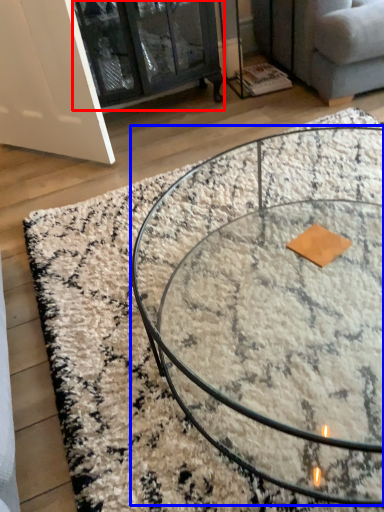
Question: Which of the following is the farthest to the observer, glass door (highlighted by a red box) or coffee table (highlighted by a blue box)?

Choices:
 (A) glass door
 (B) coffee table

Answer: (A)